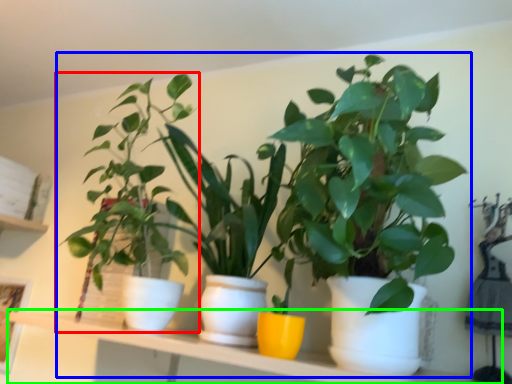
Question: Estimate the real-world distances between objects in this image. Which object is farther from houseplant (highlighted by a red box), houseplant (highlighted by a blue box) or window sill (highlighted by a green box)?

Choices:
 (A) houseplant
 (B) window sill

Answer: (B)